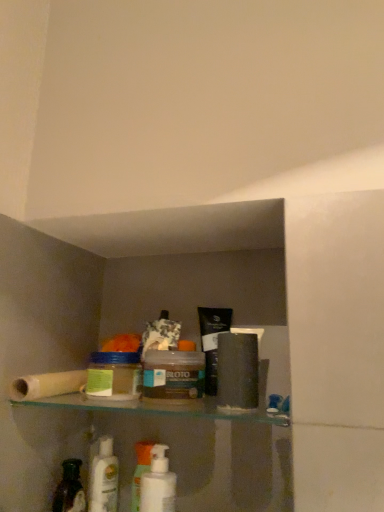
Identify the location of white plastic pump bottle at lower center. The width and height of the screenshot is (384, 512). (140, 470).

What is the approximate height of white glossy mouthwash at lower left, which is counted as the first mouthwash, starting from the back?

The height of white glossy mouthwash at lower left, which is counted as the first mouthwash, starting from the back, is 8.70 inches.

Identify the location of translucent plastic jar at center, the first product viewed from the left. The height and width of the screenshot is (512, 384). (114, 375).

You are a GUI agent. You are given a task and a screenshot of the screen. Output one action in this format:
    pyautogui.click(x=<x>, y=<y>)
    Task: Click on the translucent plastic roll at left
    The height and width of the screenshot is (512, 384).
    Given the screenshot: What is the action you would take?
    pyautogui.click(x=47, y=385)

Where is `matte brown jar at center, the 2th product from the left`? The width and height of the screenshot is (384, 512). matte brown jar at center, the 2th product from the left is located at coordinates coord(173,376).

Locate an element on the screen. This screenshot has width=384, height=512. white plastic pump bottle at lower center is located at coordinates (140, 470).

Where is `bottle behind the white plastic mouthwash at center, the 2th mouthwash in the back-to-front sequence`? bottle behind the white plastic mouthwash at center, the 2th mouthwash in the back-to-front sequence is located at coordinates (70, 489).

How different are the orientations of white plastic mouthwash at center, which appears as the 2th mouthwash when viewed from the left, and translucent plastic bottle at lower left in degrees?

They differ by 0.000211 degrees in their facing directions.

Is white plastic mouthwash at center, positioned as the 1th mouthwash in right-to-left order, completely or partially outside of translucent plastic bottle at lower left?

That's correct, white plastic mouthwash at center, positioned as the 1th mouthwash in right-to-left order, is outside of translucent plastic bottle at lower left.

Is white plastic mouthwash at center, the 2th mouthwash in the back-to-front sequence, bigger or smaller than translucent plastic bottle at lower left?

Considering their sizes, white plastic mouthwash at center, the 2th mouthwash in the back-to-front sequence, takes up more space than translucent plastic bottle at lower left.

Is white glossy mouthwash at lower left, which is counted as the first mouthwash, starting from the back, directly adjacent to translucent plastic bottle at lower left?

Yes, the surface of white glossy mouthwash at lower left, which is counted as the first mouthwash, starting from the back, is in contact with translucent plastic bottle at lower left.

From the image's perspective, is white glossy mouthwash at lower left, the 1th mouthwash in the left-to-right sequence, on translucent plastic bottle at lower left?

No, from the image's perspective, white glossy mouthwash at lower left, the 1th mouthwash in the left-to-right sequence, is not over translucent plastic bottle at lower left.

Does white glossy mouthwash at lower left, which is the 2th mouthwash from right to left, have a larger size compared to translucent plastic bottle at lower left?

Indeed, white glossy mouthwash at lower left, which is the 2th mouthwash from right to left, has a larger size compared to translucent plastic bottle at lower left.

In the scene shown: Does white glossy mouthwash at lower left, which is the 2th mouthwash from right to left, have a greater height compared to translucent plastic bottle at lower left?

Indeed, white glossy mouthwash at lower left, which is the 2th mouthwash from right to left, has a greater height compared to translucent plastic bottle at lower left.

From a real-world perspective, is matte brown jar at center, which is the first product in right-to-left order, below translucent plastic roll at left?

No, from a real-world perspective, matte brown jar at center, which is the first product in right-to-left order, is not beneath translucent plastic roll at left.

Is point (194, 367) closer to camera compared to point (75, 386)?

That is True.

Considering the sizes of objects matte brown jar at center, the 2th product from the left, and translucent plastic roll at left in the image provided, who is taller, matte brown jar at center, the 2th product from the left, or translucent plastic roll at left?

Standing taller between the two is matte brown jar at center, the 2th product from the left.

Is matte brown jar at center, which is the first product in right-to-left order, closer to the viewer compared to translucent plastic bottle at lower left?

Yes, matte brown jar at center, which is the first product in right-to-left order, is closer to the viewer.

Identify the location of bottle below the matte brown jar at center, which is the first product in right-to-left order (from a real-world perspective). (70, 489).

Is translucent plastic bottle at lower left surrounded by matte brown jar at center, which is the first product in right-to-left order?

No, matte brown jar at center, which is the first product in right-to-left order, does not contain translucent plastic bottle at lower left.

Looking at their sizes, would you say matte brown jar at center, the 2th product from the left, is wider or thinner than translucent plastic bottle at lower left?

matte brown jar at center, the 2th product from the left, is wider than translucent plastic bottle at lower left.

At what (x,y) coordinates should I click in order to perform the action: click on mouthwash in front of the white plastic pump bottle at lower center. Please return your answer as a coordinate pair (x, y). Looking at the image, I should click on [x=158, y=483].

Considering the positions of objects white plastic mouthwash at center, the 2th mouthwash in the back-to-front sequence, and white plastic pump bottle at lower center in the image provided, who is more to the left, white plastic mouthwash at center, the 2th mouthwash in the back-to-front sequence, or white plastic pump bottle at lower center?

From the viewer's perspective, white plastic pump bottle at lower center appears more on the left side.

Is point (155, 510) in front of point (132, 495)?

That is True.

Is white plastic mouthwash at center, which ranks as the first mouthwash in front-to-back order, smaller than white plastic pump bottle at lower center?

→ Incorrect, white plastic mouthwash at center, which ranks as the first mouthwash in front-to-back order, is not smaller in size than white plastic pump bottle at lower center.

Between translucent plastic jar at center, acting as the second product starting from the right, and white plastic mouthwash at center, which ranks as the first mouthwash in front-to-back order, which one has larger size?

white plastic mouthwash at center, which ranks as the first mouthwash in front-to-back order.

Would you say translucent plastic jar at center, the first product viewed from the left, contains white plastic mouthwash at center, which ranks as the first mouthwash in front-to-back order?

No, white plastic mouthwash at center, which ranks as the first mouthwash in front-to-back order, is located outside of translucent plastic jar at center, the first product viewed from the left.

From a real-world perspective, is translucent plastic jar at center, acting as the second product starting from the right, physically located above or below white plastic mouthwash at center, which appears as the 2th mouthwash when viewed from the left?

Clearly, from a real-world perspective, translucent plastic jar at center, acting as the second product starting from the right, is above white plastic mouthwash at center, which appears as the 2th mouthwash when viewed from the left.

Is translucent plastic jar at center, the first product viewed from the left, taller than white plastic mouthwash at center, positioned as the 1th mouthwash in right-to-left order?

No.

In the scene shown: Does white plastic pump bottle at lower center have a lesser width compared to matte brown jar at center, which is the first product in right-to-left order?

Indeed, white plastic pump bottle at lower center has a lesser width compared to matte brown jar at center, which is the first product in right-to-left order.

Is white plastic pump bottle at lower center positioned far away from matte brown jar at center, which is the first product in right-to-left order?

No, white plastic pump bottle at lower center is not far away from matte brown jar at center, which is the first product in right-to-left order.

This screenshot has width=384, height=512. I want to click on toiletry behind the matte brown jar at center, which is the first product in right-to-left order, so click(140, 470).

In order to click on bottle on the left side of white plastic mouthwash at center, positioned as the 1th mouthwash in right-to-left order in this screenshot , I will do `click(70, 489)`.

From a real-world perspective, which mouthwash is the 1st one above the translucent plastic bottle at lower left? Please provide its 2D coordinates.

[(104, 478)]

Looking at the image, which one is located closer to white plastic pump bottle at lower center, white glossy mouthwash at lower left, the 1th mouthwash in the left-to-right sequence, or translucent plastic bottle at lower left?

Based on the image, white glossy mouthwash at lower left, the 1th mouthwash in the left-to-right sequence, appears to be nearer to white plastic pump bottle at lower center.

Looking at the image, which one is located further to white plastic pump bottle at lower center, translucent plastic roll at left or white plastic mouthwash at center, the 2th mouthwash in the back-to-front sequence?

The object further to white plastic pump bottle at lower center is translucent plastic roll at left.

Which object lies nearer to the anchor point matte brown jar at center, the 2th product from the left, translucent plastic jar at center, acting as the second product starting from the right, or white glossy mouthwash at lower left, which is counted as the first mouthwash, starting from the back?

translucent plastic jar at center, acting as the second product starting from the right, lies closer to matte brown jar at center, the 2th product from the left, than the other object.

Looking at the image, which one is located closer to white glossy mouthwash at lower left, which is the 2th mouthwash from right to left, matte brown jar at center, which is the first product in right-to-left order, or white plastic pump bottle at lower center?

white plastic pump bottle at lower center is closer to white glossy mouthwash at lower left, which is the 2th mouthwash from right to left.

From the image, which object appears to be nearer to matte brown jar at center, the 2th product from the left, white glossy mouthwash at lower left, which is the 2th mouthwash from right to left, or white plastic mouthwash at center, the 2th mouthwash in the back-to-front sequence?

white plastic mouthwash at center, the 2th mouthwash in the back-to-front sequence, lies closer to matte brown jar at center, the 2th product from the left, than the other object.

Based on their spatial positions, is translucent plastic roll at left or white glossy mouthwash at lower left, which is the 2th mouthwash from right to left, further from white plastic pump bottle at lower center?

translucent plastic roll at left is further to white plastic pump bottle at lower center.

Which object lies further to the anchor point translucent plastic bottle at lower left, white glossy mouthwash at lower left, which is counted as the first mouthwash, starting from the back, or translucent plastic jar at center, the first product viewed from the left?

translucent plastic jar at center, the first product viewed from the left, is positioned further to the anchor translucent plastic bottle at lower left.

From the picture: Estimate the real-world distances between objects in this image. Which object is closer to white plastic pump bottle at lower center, white plastic mouthwash at center, positioned as the 1th mouthwash in right-to-left order, or matte brown jar at center, which is the first product in right-to-left order?

Among the two, white plastic mouthwash at center, positioned as the 1th mouthwash in right-to-left order, is located nearer to white plastic pump bottle at lower center.

Find the location of a particular element. toilet paper between translucent plastic jar at center, the first product viewed from the left, and white plastic mouthwash at center, positioned as the 1th mouthwash in right-to-left order, vertically is located at coordinates (47, 385).

Locate an element on the screen. Image resolution: width=384 pixels, height=512 pixels. product between translucent plastic jar at center, the first product viewed from the left, and translucent plastic bottle at lower left in the up-down direction is located at coordinates (173, 376).

Where is `mouthwash between translucent plastic jar at center, acting as the second product starting from the right, and translucent plastic bottle at lower left, in the vertical direction`? The width and height of the screenshot is (384, 512). mouthwash between translucent plastic jar at center, acting as the second product starting from the right, and translucent plastic bottle at lower left, in the vertical direction is located at coordinates (158, 483).

Image resolution: width=384 pixels, height=512 pixels. I want to click on mouthwash between matte brown jar at center, the 2th product from the left, and white glossy mouthwash at lower left, placed as the second mouthwash when sorted from front to back, vertically, so click(x=158, y=483).